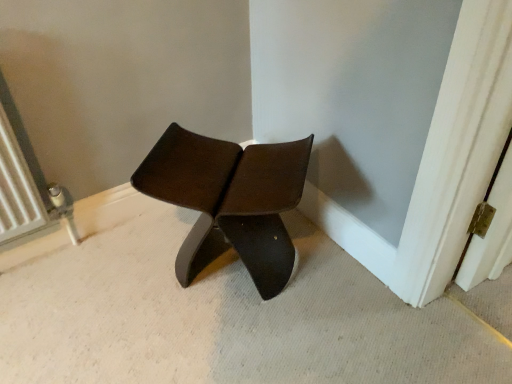
What do you see at coordinates (229, 200) in the screenshot?
I see `matte dark brown chair at center` at bounding box center [229, 200].

The width and height of the screenshot is (512, 384). I want to click on matte dark brown chair at center, so click(229, 200).

Where is `matte dark brown chair at center`? This screenshot has width=512, height=384. matte dark brown chair at center is located at coordinates (229, 200).